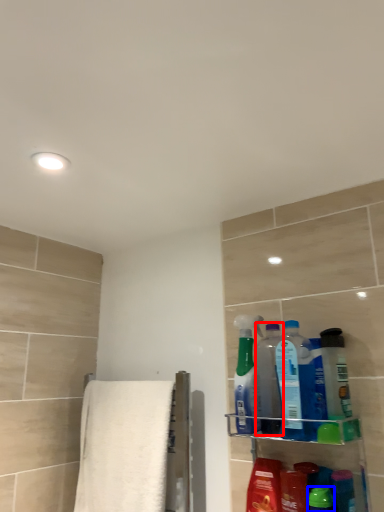
Question: Which point is further to the camera, cleaning product (highlighted by a red box) or cleaning product (highlighted by a blue box)?

Choices:
 (A) cleaning product
 (B) cleaning product

Answer: (A)